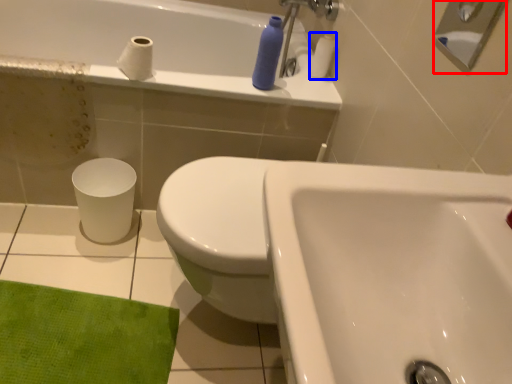
Question: Which point is closer to the camera, shower (highlighted by a red box) or toilet paper (highlighted by a blue box)?

Choices:
 (A) shower
 (B) toilet paper

Answer: (A)